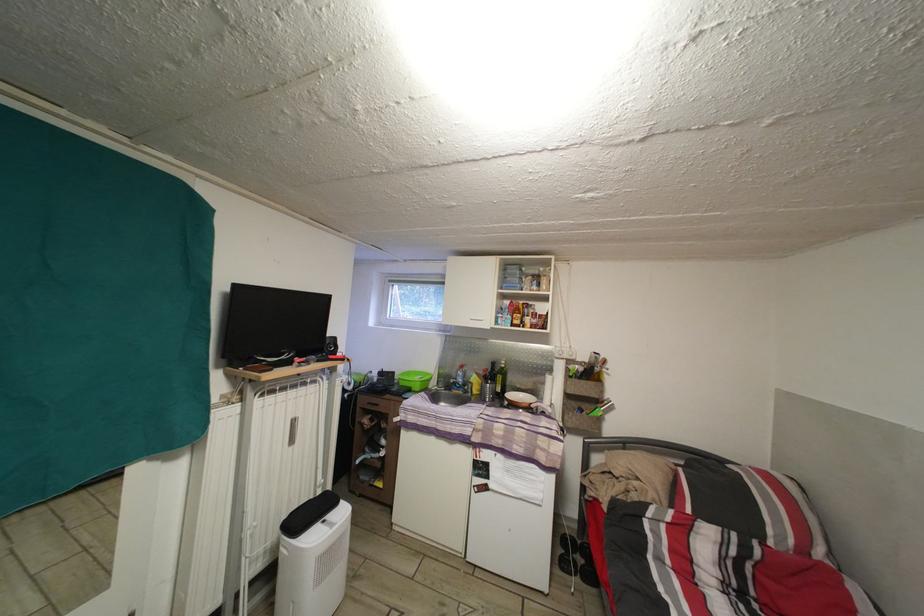
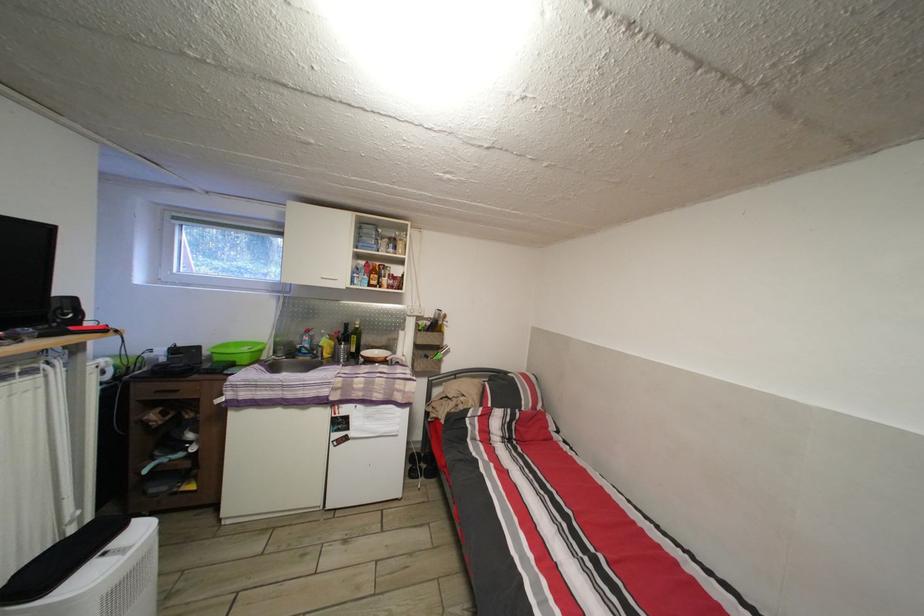
Find the pixel in the second image that matches (506,384) in the first image.

(360, 345)